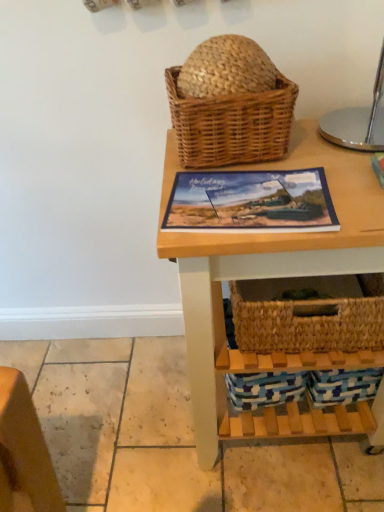
At what (x,y) coordinates should I click in order to perform the action: click on free spot to the right of matte plastic picture frame at center. Please return your answer as a coordinate pair (x, y). The height and width of the screenshot is (512, 384). Looking at the image, I should click on (344, 180).